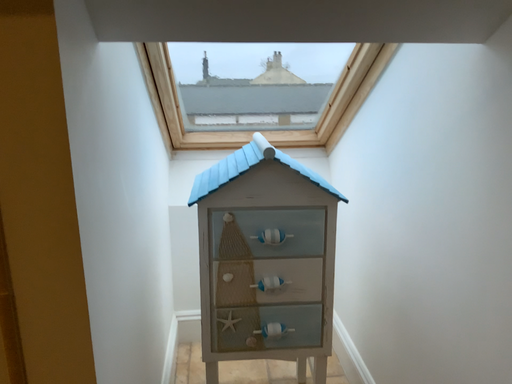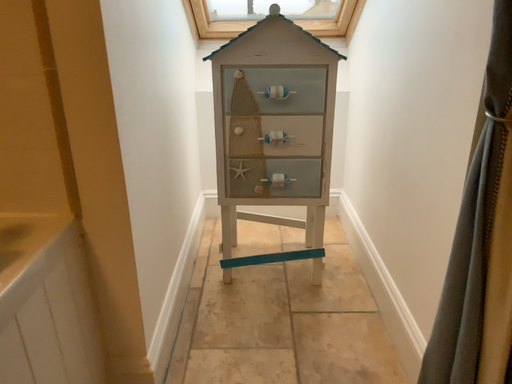
Question: How did the camera likely rotate when shooting the video?

Choices:
 (A) rotated upward
 (B) rotated downward

Answer: (B)